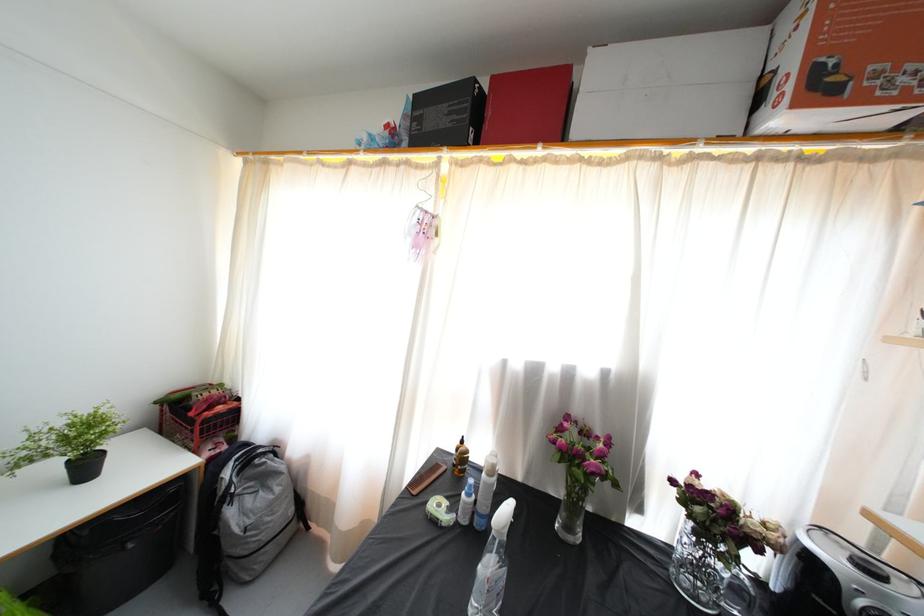
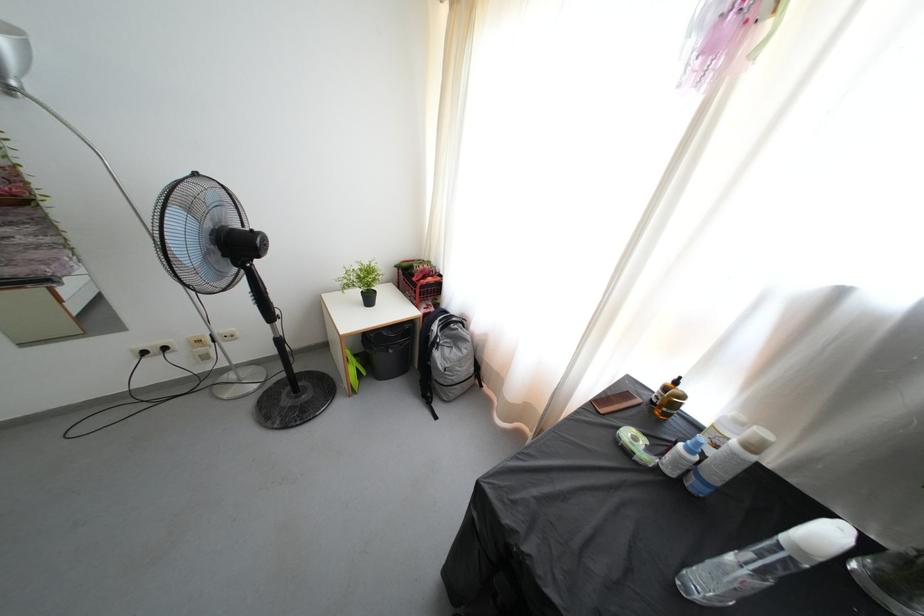
Where in the second image is the point corresponding to point 226,391 from the first image?

(434, 268)